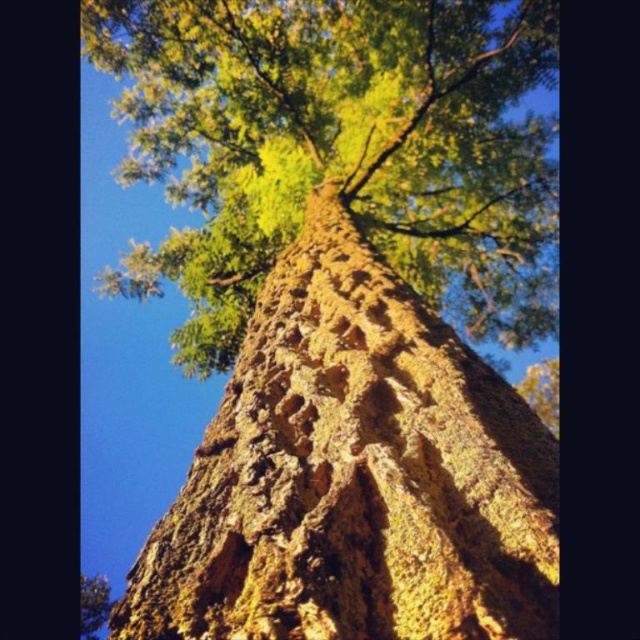
You are standing at the base of the tree trunk and want to reach a point on the tree that is 2.81 meters away from your current position. Given that the point you need to reach is labeled as point (x=368, y=256), can you estimate whether you can reach it without any tools?

The point (x=368, y=256) is 2.81 meters away from the camera, so you cannot reach it without any tools since it is beyond typical human arm reach.

You are a photographer standing 36 inches away from a tree. You want to take a close up photo of the green mossy bark at center. Is the current distance sufficient for a clear close up?

The green mossy bark at center is 34.07 inches away from the camera, so the photographer is 36 inches away from the tree. Since the distance between the photographer and the bark is slightly larger than the required 34.07 inches, the current distance may not be sufficient for a clear close up. The photographer should move 1.93 inches closer to achieve the optimal distance.